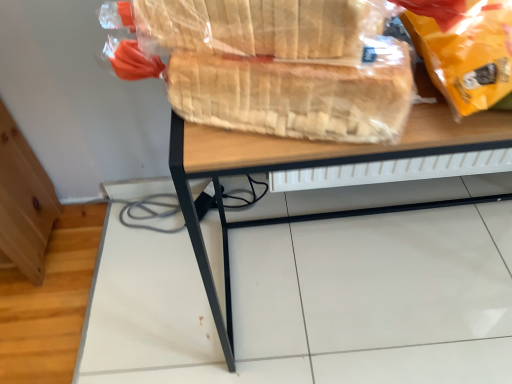
Question: Which direction should I rotate to face translucent plastic bread at center, placed as the first bread when sorted from bottom to top, — up or down?

Choices:
 (A) up
 (B) down

Answer: (A)

Question: Is the surface of matte yellow plastic bag at upper right in direct contact with wooden desk at center?

Choices:
 (A) no
 (B) yes

Answer: (A)

Question: Considering the relative positions of matte yellow plastic bag at upper right and wooden desk at center in the image provided, is matte yellow plastic bag at upper right in front of wooden desk at center?

Choices:
 (A) yes
 (B) no

Answer: (A)

Question: From a real-world perspective, is matte yellow plastic bag at upper right under wooden desk at center?

Choices:
 (A) no
 (B) yes

Answer: (A)

Question: Is matte yellow plastic bag at upper right far away from wooden desk at center?

Choices:
 (A) yes
 (B) no

Answer: (B)

Question: Considering the relative sizes of matte yellow plastic bag at upper right and wooden desk at center in the image provided, is matte yellow plastic bag at upper right bigger than wooden desk at center?

Choices:
 (A) no
 (B) yes

Answer: (A)

Question: From a real-world perspective, is matte yellow plastic bag at upper right located higher than wooden desk at center?

Choices:
 (A) yes
 (B) no

Answer: (A)

Question: Is wooden desk at center with translucent plastic bread at center, the 2th bread from the top?

Choices:
 (A) yes
 (B) no

Answer: (B)

Question: From the image's perspective, is wooden desk at center located beneath translucent plastic bread at center, the 2th bread from the top?

Choices:
 (A) no
 (B) yes

Answer: (B)

Question: Considering the relative sizes of wooden desk at center and translucent plastic bread at center, placed as the first bread when sorted from bottom to top, in the image provided, is wooden desk at center shorter than translucent plastic bread at center, placed as the first bread when sorted from bottom to top,?

Choices:
 (A) yes
 (B) no

Answer: (B)

Question: Does wooden desk at center lie in front of translucent plastic bread at center, the 2th bread from the top?

Choices:
 (A) no
 (B) yes

Answer: (A)

Question: Does wooden desk at center have a larger size compared to translucent plastic bread at center, placed as the first bread when sorted from bottom to top?

Choices:
 (A) no
 (B) yes

Answer: (B)

Question: Is wooden desk at center thinner than translucent plastic bread at center, the 2th bread from the top?

Choices:
 (A) yes
 (B) no

Answer: (B)

Question: Considering the relative sizes of translucent plastic bread at center, the 2th bread from the top, and translucent plastic bread at upper center, acting as the first bread starting from the top, in the image provided, is translucent plastic bread at center, the 2th bread from the top, thinner than translucent plastic bread at upper center, acting as the first bread starting from the top,?

Choices:
 (A) no
 (B) yes

Answer: (B)